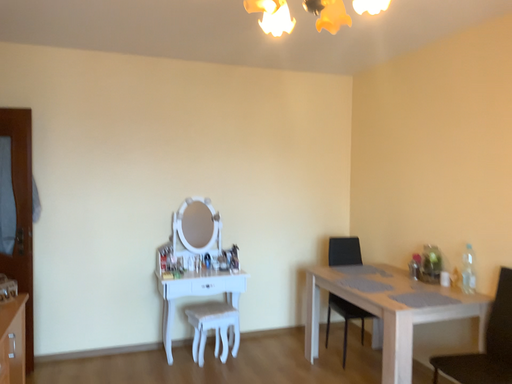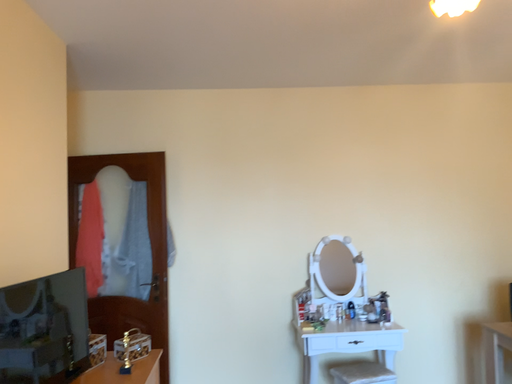
Question: Which way did the camera rotate in the video?

Choices:
 (A) rotated left
 (B) rotated right

Answer: (A)